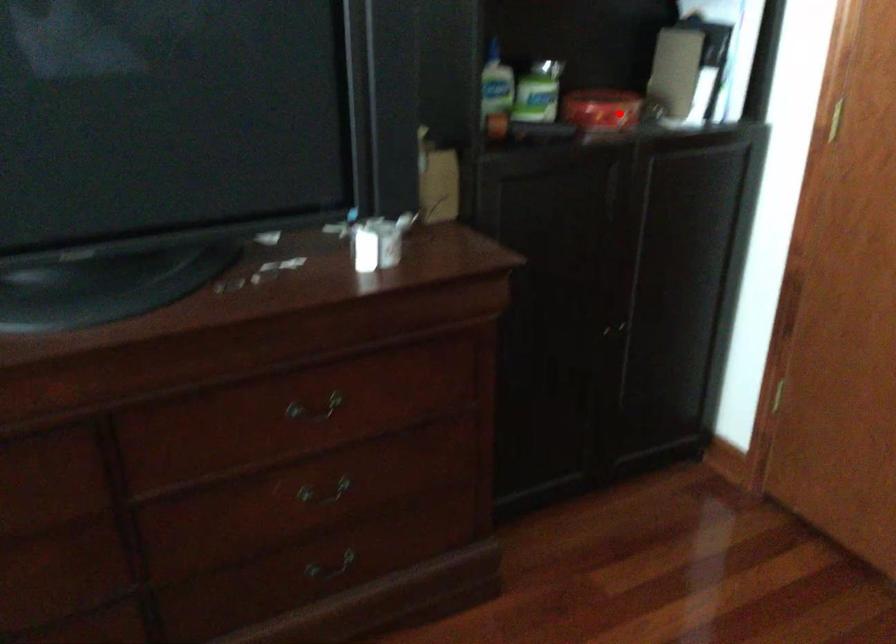
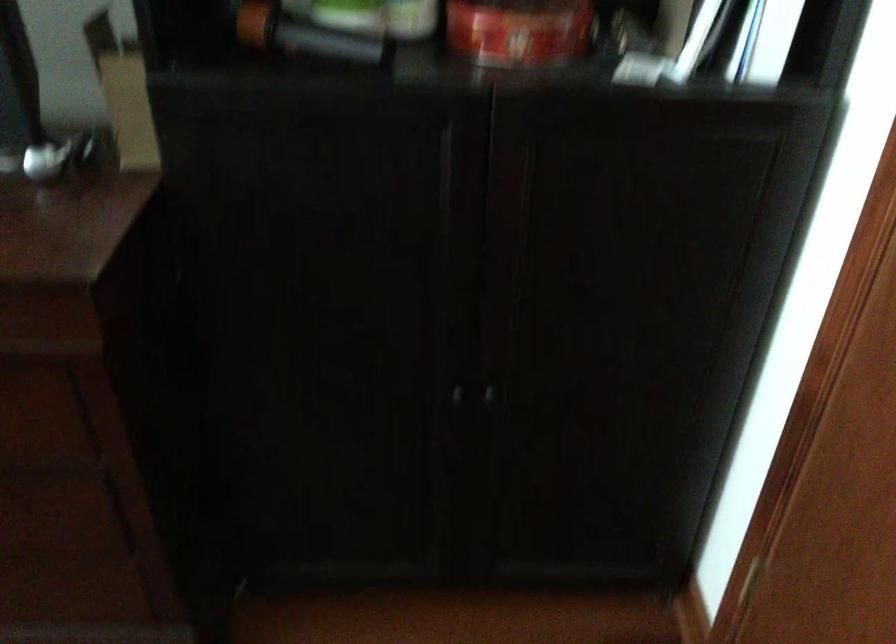
Find the pixel in the second image that matches the highlighted location in the first image.

(519, 31)